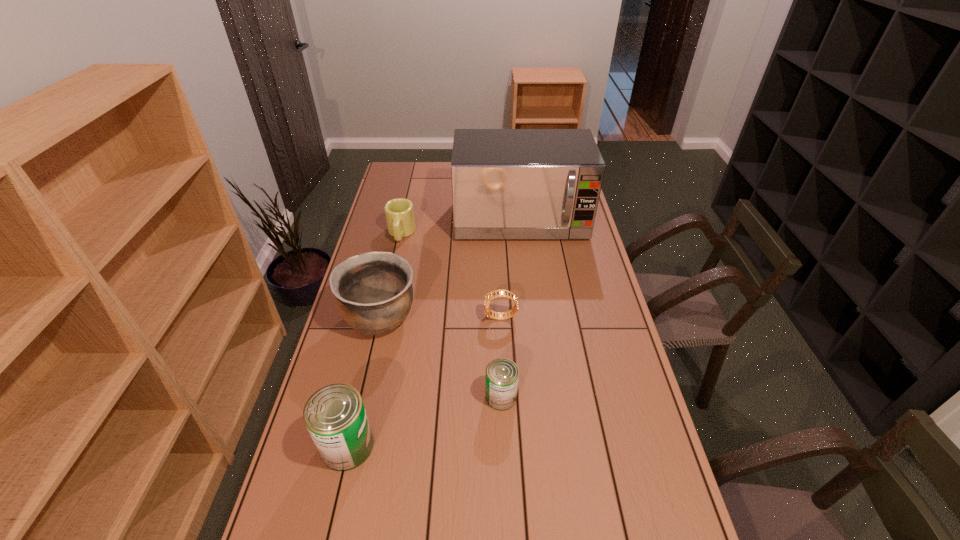
At what (x,y) coordinates should I click in order to perform the action: click on free point at the far edge. Please return your answer as a coordinate pair (x, y). Looking at the image, I should click on (434, 168).

Where is `free space at the near edge`? free space at the near edge is located at coordinates (357, 519).

In the image, there is a desktop. At what (x,y) coordinates should I click in order to perform the action: click on vacant space at the left edge. Please return your answer as a coordinate pair (x, y). This screenshot has width=960, height=540. Looking at the image, I should click on (375, 234).

Image resolution: width=960 pixels, height=540 pixels. Find the location of `free space at the right edge of the desktop`. free space at the right edge of the desktop is located at coordinates (597, 379).

Find the location of a particular element. Image resolution: width=960 pixels, height=540 pixels. free space at the far left corner of the desktop is located at coordinates (416, 180).

Find the location of a particular element. The image size is (960, 540). vacant space at the near left corner of the desktop is located at coordinates (300, 538).

Find the location of `free space between the left can and the pottery`. free space between the left can and the pottery is located at coordinates (364, 382).

Where is `vacant area that lies between the pottery and the tallest object`? Image resolution: width=960 pixels, height=540 pixels. vacant area that lies between the pottery and the tallest object is located at coordinates (450, 269).

Identify the location of blank region between the microwave oven and the fifth farthest object. The width and height of the screenshot is (960, 540). (511, 309).

This screenshot has width=960, height=540. I want to click on empty space that is in between the pottery and the nearest object, so 364,382.